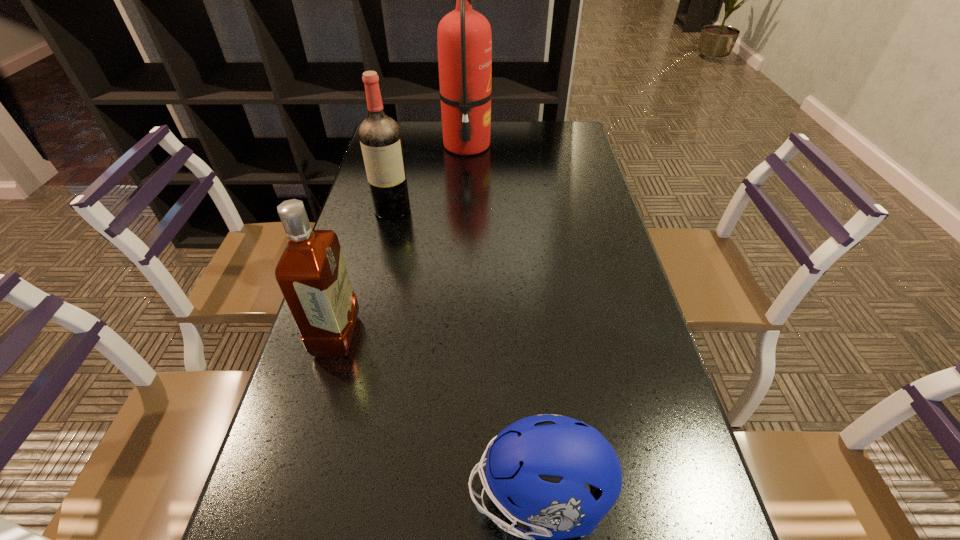
At what (x,y) coordinates should I click in order to perform the action: click on the farthest object. Please return your answer as a coordinate pair (x, y). This screenshot has height=540, width=960. Looking at the image, I should click on (464, 39).

Where is `fire extinguisher`? fire extinguisher is located at coordinates (464, 39).

The height and width of the screenshot is (540, 960). In order to click on the farther liquor in this screenshot , I will do `click(380, 137)`.

The image size is (960, 540). I want to click on the second nearest object, so click(312, 275).

Identify the location of free space located on the side of the fire extinguisher with the nozzle and handle. (582, 146).

The width and height of the screenshot is (960, 540). Identify the location of free point located 0.250m on the front-facing side of the farther liquor. (375, 284).

Find the location of `free space located on the front label of the third farthest object`. free space located on the front label of the third farthest object is located at coordinates (493, 336).

The image size is (960, 540). In order to click on object located at the far edge in this screenshot , I will do `click(464, 39)`.

Where is `free space at the left edge of the desktop`? The height and width of the screenshot is (540, 960). free space at the left edge of the desktop is located at coordinates (388, 228).

Locate an element on the screen. vacant position at the right edge of the desktop is located at coordinates (615, 265).